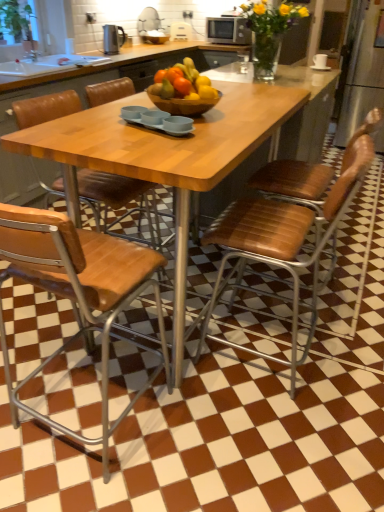
Question: Is wooden bowl at center oriented towards wooden at center, arranged as the third chair when viewed from the right?

Choices:
 (A) no
 (B) yes

Answer: (A)

Question: Does wooden bowl at center have a lesser height compared to wooden at center, arranged as the third chair when viewed from the right?

Choices:
 (A) yes
 (B) no

Answer: (A)

Question: Is the position of wooden bowl at center less distant than that of wooden at center, marked as the second chair in a left-to-right arrangement?

Choices:
 (A) no
 (B) yes

Answer: (A)

Question: From the image's perspective, is wooden bowl at center above wooden at center, marked as the second chair in a left-to-right arrangement?

Choices:
 (A) yes
 (B) no

Answer: (A)

Question: Is wooden bowl at center not near wooden at center, arranged as the third chair when viewed from the right?

Choices:
 (A) yes
 (B) no

Answer: (B)

Question: Looking at their shapes, would you say brown leather chair at right, which ranks as the 4th chair in left-to-right order, is wider or thinner than translucent glass vase at upper center?

Choices:
 (A) thin
 (B) wide

Answer: (B)

Question: From their relative heights in the image, would you say brown leather chair at right, which ranks as the 4th chair in left-to-right order, is taller or shorter than translucent glass vase at upper center?

Choices:
 (A) short
 (B) tall

Answer: (B)

Question: From the image's perspective, is brown leather chair at right, which ranks as the 4th chair in left-to-right order, positioned above or below translucent glass vase at upper center?

Choices:
 (A) below
 (B) above

Answer: (A)

Question: Considering the positions of point (279, 173) and point (241, 11), is point (279, 173) closer or farther from the camera than point (241, 11)?

Choices:
 (A) farther
 (B) closer

Answer: (B)

Question: Relative to matte silver microwave at upper center, acting as the 1th appliance starting from the top, is brown leather chair at center, acting as the third chair starting from the left, in front or behind?

Choices:
 (A) front
 (B) behind

Answer: (A)

Question: From a real-world perspective, is brown leather chair at center, acting as the third chair starting from the left, physically located above or below matte silver microwave at upper center, marked as the 2th appliance in a left-to-right arrangement?

Choices:
 (A) above
 (B) below

Answer: (B)

Question: Considering the positions of point click(x=266, y=243) and point click(x=233, y=28), is point click(x=266, y=243) closer or farther from the camera than point click(x=233, y=28)?

Choices:
 (A) farther
 (B) closer

Answer: (B)

Question: Is brown leather chair at center, acting as the third chair starting from the left, inside the boundaries of matte silver microwave at upper center, which is the 1th appliance in back-to-front order, or outside?

Choices:
 (A) inside
 (B) outside

Answer: (B)

Question: In terms of width, does wooden table at center look wider or thinner when compared to wooden at center, positioned as the first chair in left-to-right order?

Choices:
 (A) thin
 (B) wide

Answer: (B)

Question: Considering the positions of point (246, 84) and point (29, 118), is point (246, 84) closer or farther from the camera than point (29, 118)?

Choices:
 (A) farther
 (B) closer

Answer: (A)